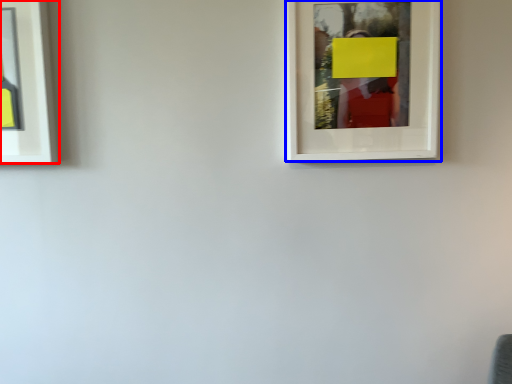
Question: Which point is further to the camera, picture frame (highlighted by a red box) or picture frame (highlighted by a blue box)?

Choices:
 (A) picture frame
 (B) picture frame

Answer: (A)